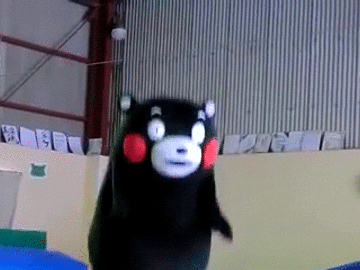
This screenshot has width=360, height=270. I want to click on the left side of wall, so click(x=29, y=74).